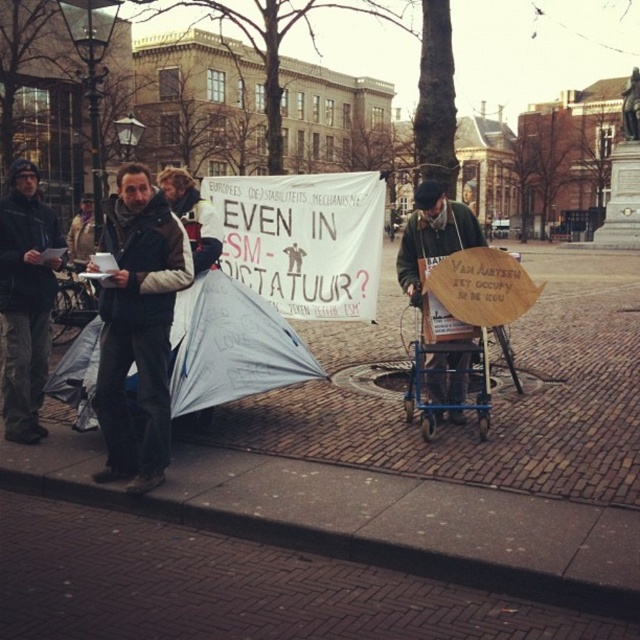
Does brick pavement at center have a lesser width compared to gray fabric tent at center?

In fact, brick pavement at center might be wider than gray fabric tent at center.

Which is behind, point (0, 467) or point (172, 376)?

Positioned behind is point (172, 376).

Image resolution: width=640 pixels, height=640 pixels. Identify the location of brick pavement at center. (428, 461).

From the picture: Who is more forward, (333, 531) or (115, 292)?

Point (333, 531)

Can you confirm if brick pavement at center is positioned to the left of dark brown jacket at center?

In fact, brick pavement at center is to the right of dark brown jacket at center.

Find the location of a particular element. Image resolution: width=640 pixels, height=640 pixels. brick pavement at center is located at coordinates (428, 461).

Which is behind, point (253, 384) or point (36, 308)?

The point (253, 384) is more distant.

Is gray fabric tent at center to the left of dark gray jacket at left from the viewer's perspective?

No, gray fabric tent at center is not to the left of dark gray jacket at left.

Does point (177, 324) lie in front of point (45, 316)?

Yes.

What are the coordinates of `gray fabric tent at center` in the screenshot? It's located at (230, 346).